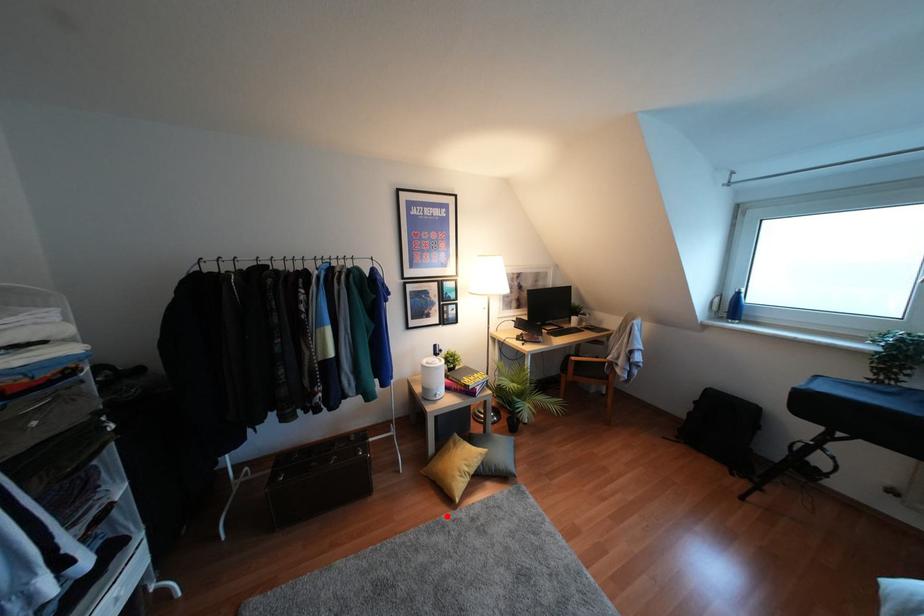
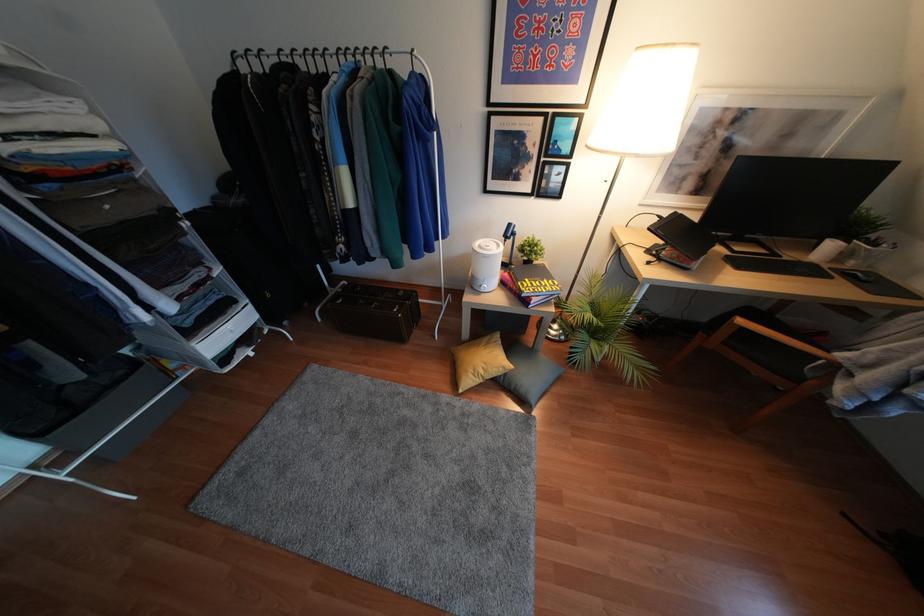
Where in the second image is the point corresponding to the highlighted location from the first image?

(445, 397)